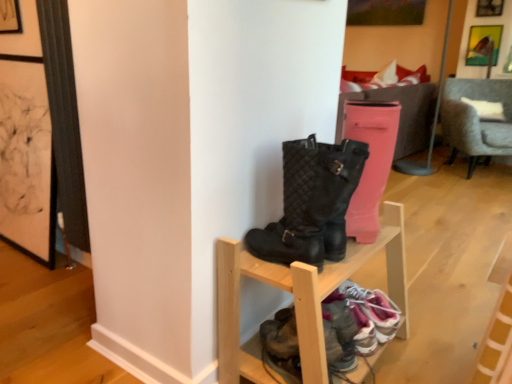
Question: Which direction should I rotate to look at leather sneakers at lower center, which appears as the 1th footwear when viewed from the left, — up or down?

Choices:
 (A) down
 (B) up

Answer: (A)

Question: From the image's perspective, is white fabric pillow at upper center above gray fabric chair at right?

Choices:
 (A) yes
 (B) no

Answer: (A)

Question: Does white fabric pillow at upper center have a lesser height compared to gray fabric chair at right?

Choices:
 (A) no
 (B) yes

Answer: (B)

Question: Does white fabric pillow at upper center have a greater height compared to gray fabric chair at right?

Choices:
 (A) yes
 (B) no

Answer: (B)

Question: Can we say white fabric pillow at upper center lies outside gray fabric chair at right?

Choices:
 (A) yes
 (B) no

Answer: (A)

Question: Can you confirm if white fabric pillow at upper center is bigger than gray fabric chair at right?

Choices:
 (A) no
 (B) yes

Answer: (A)

Question: Is white fabric pillow at upper center looking in the opposite direction of gray fabric chair at right?

Choices:
 (A) yes
 (B) no

Answer: (B)

Question: Could wooden shoe rack at center be considered to be inside white fabric pillow at upper center?

Choices:
 (A) no
 (B) yes

Answer: (A)

Question: Considering the relative positions of white fabric pillow at upper center and wooden shoe rack at center in the image provided, is white fabric pillow at upper center to the left of wooden shoe rack at center from the viewer's perspective?

Choices:
 (A) no
 (B) yes

Answer: (A)

Question: Could you tell me if white fabric pillow at upper center is turned towards wooden shoe rack at center?

Choices:
 (A) yes
 (B) no

Answer: (B)

Question: From the image's perspective, is white fabric pillow at upper center beneath wooden shoe rack at center?

Choices:
 (A) no
 (B) yes

Answer: (A)

Question: Is white fabric pillow at upper center thinner than wooden shoe rack at center?

Choices:
 (A) no
 (B) yes

Answer: (B)

Question: Does white fabric pillow at upper center appear on the right side of wooden shoe rack at center?

Choices:
 (A) yes
 (B) no

Answer: (A)

Question: From the image's perspective, is metallic gold picture frame at upper right below gray fabric chair at right?

Choices:
 (A) yes
 (B) no

Answer: (B)